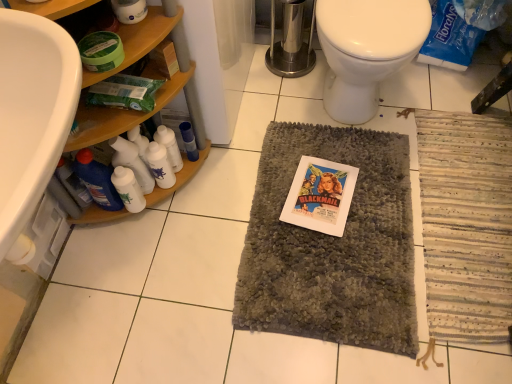
I want to click on free spot to the right of woodenshelves at left, so click(246, 188).